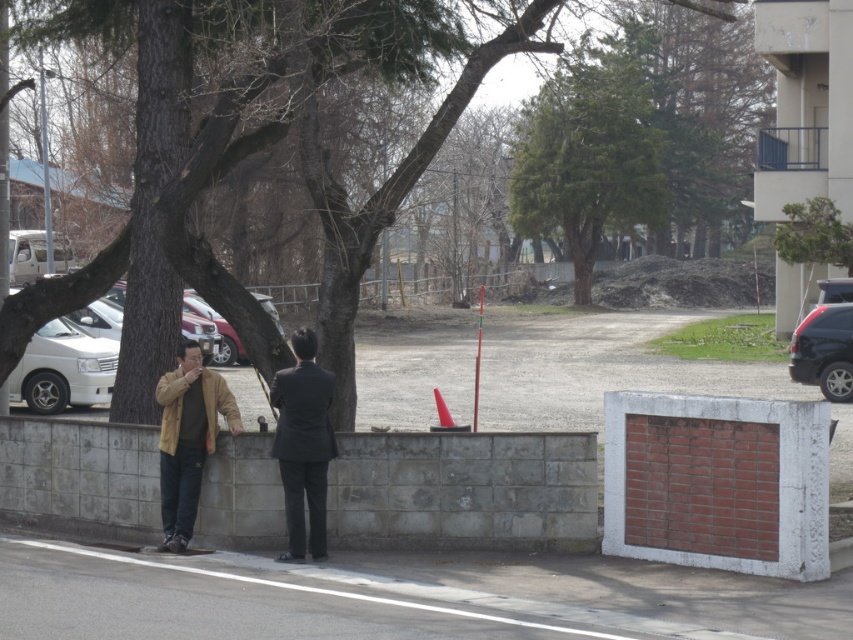
You are a photographer trying to capture a photo of the brown bark tree at center and the white matte van at left. Based on their sizes in the image, which object would appear taller in the photo?

The brown bark tree at center appears taller in the photo because it has a greater height compared to the white matte van at left.

You are a painter setting up an easel to paint the scene. You want to focus on capturing the brown bark tree at center and the matte brown jacket at center. Which object should you place closer to the edge of your canvas to ensure it doesn not dominate the composition?

The brown bark tree at center might be wider than the matte brown jacket at center, so to avoid it dominating the composition, place the brown bark tree at center closer to the edge of the canvas.